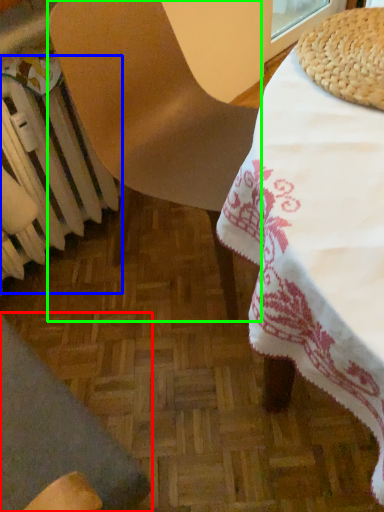
Question: Considering the real-world distances, which object is closest to chair (highlighted by a red box)? radiator (highlighted by a blue box) or chair (highlighted by a green box).

Choices:
 (A) radiator
 (B) chair

Answer: (A)